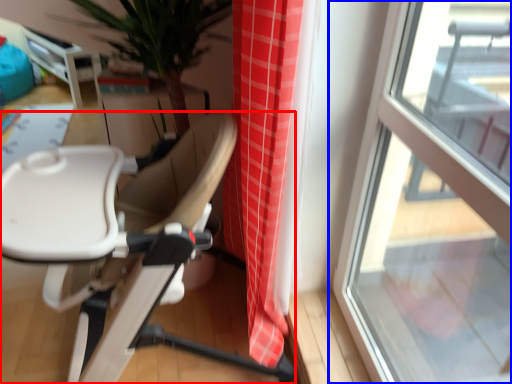
Question: Which object is further to the camera taking this photo, chair (highlighted by a red box) or window (highlighted by a blue box)?

Choices:
 (A) chair
 (B) window

Answer: (A)